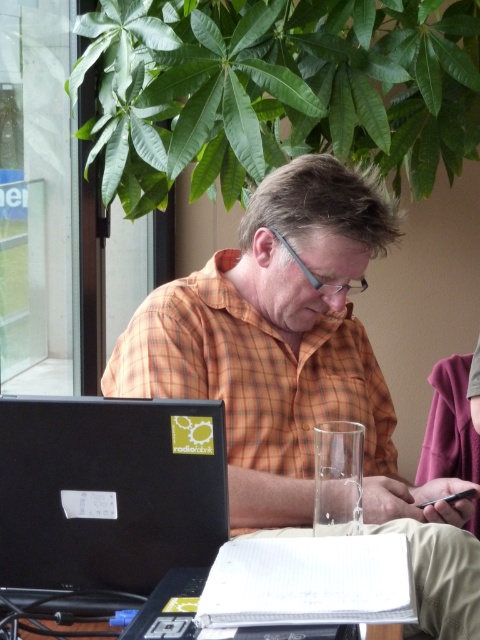
Looking at this image, does white textured notebook at center have a smaller size compared to white paper at lower center?

Correct, white textured notebook at center occupies less space than white paper at lower center.

In the scene shown: Who is shorter, white textured notebook at center or white paper at lower center?

With less height is white textured notebook at center.

Find the location of `white textured notebook at center`. white textured notebook at center is located at coordinates (309, 580).

Can you confirm if black matte laptop at lower left is positioned to the right of white textured notebook at center?

No, black matte laptop at lower left is not to the right of white textured notebook at center.

Which is above, black matte laptop at lower left or white textured notebook at center?

black matte laptop at lower left is higher up.

Describe the element at coordinates (108, 490) in the screenshot. This screenshot has height=640, width=480. I see `black matte laptop at lower left` at that location.

In order to click on black matte laptop at lower left in this screenshot , I will do `click(108, 490)`.

Which is more to the left, orange checkered shirt at center or white textured notebook at center?

orange checkered shirt at center is more to the left.

Between orange checkered shirt at center and white textured notebook at center, which one is positioned lower?

white textured notebook at center

Between point (264, 467) and point (386, 577), which one is positioned in front?

Point (386, 577) is more forward.

The height and width of the screenshot is (640, 480). Identify the location of orange checkered shirt at center. (300, 372).